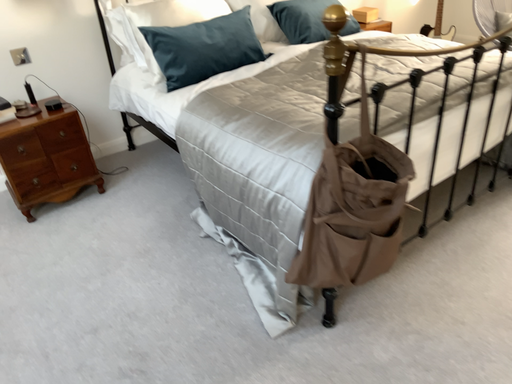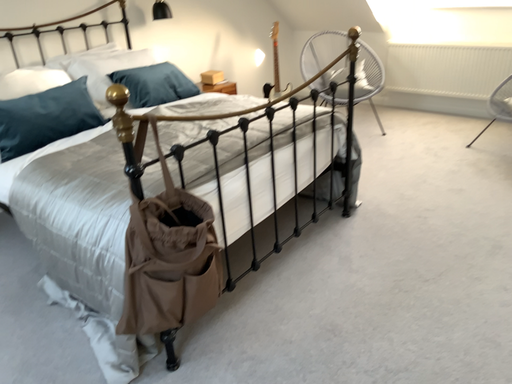
Question: Which way did the camera rotate in the video?

Choices:
 (A) rotated upward
 (B) rotated downward

Answer: (A)